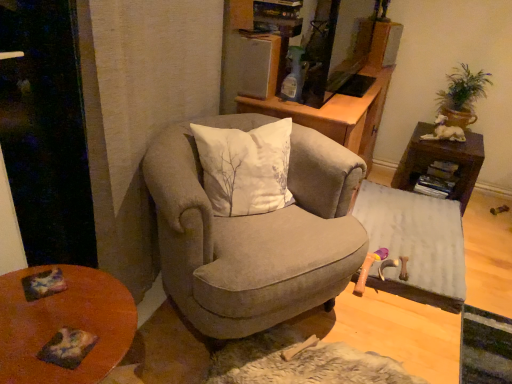
This screenshot has height=384, width=512. Describe the element at coordinates (336, 113) in the screenshot. I see `wooden cabinet at center` at that location.

You are a GUI agent. You are given a task and a screenshot of the screen. Output one action in this format:
    pyautogui.click(x=<x>, y=<y>)
    Task: Click on the green leafy plant at upper right
    
    Given the screenshot: What is the action you would take?
    pyautogui.click(x=462, y=95)

This screenshot has width=512, height=384. I want to click on wooden table at lower left, so click(64, 325).

What do you see at coordinates (255, 236) in the screenshot? This screenshot has width=512, height=384. I see `suede armchair at center` at bounding box center [255, 236].

Consider the image. Measure the distance between point (439, 147) and camera.

Point (439, 147) is 2.50 meters away from camera.

The height and width of the screenshot is (384, 512). What are the coordinates of `wooden cabinet at center` in the screenshot? It's located at (336, 113).

Could you tell me if wooden cabinet at center is facing green leafy plant at upper right?

No, wooden cabinet at center is not oriented towards green leafy plant at upper right.

Are wooden cabinet at center and green leafy plant at upper right located far from each other?

No, wooden cabinet at center is in close proximity to green leafy plant at upper right.

In the image, is wooden cabinet at center positioned in front of or behind green leafy plant at upper right?

wooden cabinet at center is positioned closer to the viewer than green leafy plant at upper right.

How many degrees apart are the facing directions of brown wooden table at right, marked as the second table in a bottom-to-top arrangement, and suede armchair at center?

53.3 degrees.

Is brown wooden table at right, which appears as the first table when viewed from the top, beside suede armchair at center?

No, brown wooden table at right, which appears as the first table when viewed from the top, is not beside suede armchair at center.

Between brown wooden table at right, which appears as the first table when viewed from the top, and suede armchair at center, which one has less height?

Standing shorter between the two is brown wooden table at right, which appears as the first table when viewed from the top.

Which object is closer to the camera taking this photo, brown wooden table at right, which appears as the first table when viewed from the top, or suede armchair at center?

suede armchair at center is more forward.

Is point (454, 107) closer to viewer compared to point (39, 303)?

No, (454, 107) is behind (39, 303).

How different are the orientations of green leafy plant at upper right and wooden table at lower left in degrees?

The facing directions of green leafy plant at upper right and wooden table at lower left are 92.8 degrees apart.

Is green leafy plant at upper right spatially inside wooden table at lower left, or outside of it?

green leafy plant at upper right is spatially situated outside wooden table at lower left.

This screenshot has height=384, width=512. Identify the location of desk below the green leafy plant at upper right (from the image's perspective). (64, 325).

Considering the positions of objects white fabric ottoman at lower right, marked as the 2th table in a top-to-bottom arrangement, and wooden cabinet at center in the image provided, who is more to the right, white fabric ottoman at lower right, marked as the 2th table in a top-to-bottom arrangement, or wooden cabinet at center?

Positioned to the right is white fabric ottoman at lower right, marked as the 2th table in a top-to-bottom arrangement.

Which object is thinner, white fabric ottoman at lower right, marked as the 2th table in a top-to-bottom arrangement, or wooden cabinet at center?

Thinner between the two is white fabric ottoman at lower right, marked as the 2th table in a top-to-bottom arrangement.

In terms of size, does white fabric ottoman at lower right, marked as the 2th table in a top-to-bottom arrangement, appear bigger or smaller than wooden cabinet at center?

Clearly, white fabric ottoman at lower right, marked as the 2th table in a top-to-bottom arrangement, is smaller in size than wooden cabinet at center.

From a real-world perspective, is white fabric ottoman at lower right, marked as the 2th table in a top-to-bottom arrangement, below wooden cabinet at center?

Yes, from a real-world perspective, white fabric ottoman at lower right, marked as the 2th table in a top-to-bottom arrangement, is under wooden cabinet at center.

Is point (330, 135) less distant than point (419, 157)?

Yes, it is.

From the image's perspective, is wooden cabinet at center above or below brown wooden table at right, which appears as the first table when viewed from the top?

From the image's perspective, wooden cabinet at center appears above brown wooden table at right, which appears as the first table when viewed from the top.

How distant is wooden cabinet at center from brown wooden table at right, which appears as the first table when viewed from the top?

The distance of wooden cabinet at center from brown wooden table at right, which appears as the first table when viewed from the top, is 20.72 inches.

From a real-world perspective, does wooden cabinet at center stand above brown wooden table at right, which appears as the first table when viewed from the top?

Yes, from a real-world perspective, wooden cabinet at center is above brown wooden table at right, which appears as the first table when viewed from the top.

In terms of size, does green leafy plant at upper right appear bigger or smaller than wooden cabinet at center?

green leafy plant at upper right is smaller than wooden cabinet at center.

From a real-world perspective, is green leafy plant at upper right above or below wooden cabinet at center?

From a real-world perspective, green leafy plant at upper right is physically above wooden cabinet at center.

Does point (454, 97) come farther from viewer compared to point (315, 108)?

Yes, it is behind point (315, 108).

Is green leafy plant at upper right oriented towards wooden cabinet at center?

No.

Considering the relative sizes of wooden table at lower left and green leafy plant at upper right in the image provided, is wooden table at lower left thinner than green leafy plant at upper right?

In fact, wooden table at lower left might be wider than green leafy plant at upper right.

Considering the positions of objects wooden table at lower left and green leafy plant at upper right in the image provided, who is behind, wooden table at lower left or green leafy plant at upper right?

green leafy plant at upper right is further from the camera.

Is wooden table at lower left aimed at green leafy plant at upper right?

No, wooden table at lower left is not turned towards green leafy plant at upper right.

Is point (83, 286) farther from viewer compared to point (449, 98)?

That is False.

Locate an element on the screen. The height and width of the screenshot is (384, 512). houseplant behind the wooden cabinet at center is located at coordinates (462, 95).

Locate an element on the screen. Image resolution: width=512 pixels, height=384 pixels. the 2nd table counting from the right side of the suede armchair at center is located at coordinates (441, 161).

When comparing their distances from suede armchair at center, does brown wooden table at right, marked as the second table in a bottom-to-top arrangement, or wooden table at lower left seem further?

Based on the image, brown wooden table at right, marked as the second table in a bottom-to-top arrangement, appears to be further to suede armchair at center.

When comparing their distances from white fabric ottoman at lower right, marked as the 2th table in a top-to-bottom arrangement, does brown wooden table at right, which appears as the first table when viewed from the top, or wooden cabinet at center seem closer?

Based on the image, brown wooden table at right, which appears as the first table when viewed from the top, appears to be nearer to white fabric ottoman at lower right, marked as the 2th table in a top-to-bottom arrangement.

Based on their spatial positions, is green leafy plant at upper right or wooden cabinet at center further from wooden table at lower left?

The object further to wooden table at lower left is green leafy plant at upper right.

From the picture: Based on their spatial positions, is wooden cabinet at center or brown wooden table at right, which appears as the first table when viewed from the top, closer to white fabric ottoman at lower right, marked as the 2th table in a top-to-bottom arrangement?

brown wooden table at right, which appears as the first table when viewed from the top, is positioned closer to the anchor white fabric ottoman at lower right, marked as the 2th table in a top-to-bottom arrangement.

When comparing their distances from brown wooden table at right, marked as the second table in a bottom-to-top arrangement, does white fabric ottoman at lower right, marked as the 2th table in a top-to-bottom arrangement, or wooden table at lower left seem closer?

Based on the image, white fabric ottoman at lower right, marked as the 2th table in a top-to-bottom arrangement, appears to be nearer to brown wooden table at right, marked as the second table in a bottom-to-top arrangement.

Considering their positions, is wooden cabinet at center positioned further to white fabric ottoman at lower right, acting as the first table starting from the bottom, than wooden table at lower left?

wooden table at lower left lies further to white fabric ottoman at lower right, acting as the first table starting from the bottom, than the other object.

From the image, which object appears to be nearer to wooden cabinet at center, green leafy plant at upper right or white fabric ottoman at lower right, marked as the 2th table in a top-to-bottom arrangement?

The object closer to wooden cabinet at center is white fabric ottoman at lower right, marked as the 2th table in a top-to-bottom arrangement.

Which object lies nearer to the anchor point white fabric ottoman at lower right, marked as the 2th table in a top-to-bottom arrangement, suede armchair at center or green leafy plant at upper right?

green leafy plant at upper right is closer to white fabric ottoman at lower right, marked as the 2th table in a top-to-bottom arrangement.

Where is `table between suede armchair at center and green leafy plant at upper right from front to back`? The height and width of the screenshot is (384, 512). table between suede armchair at center and green leafy plant at upper right from front to back is located at coordinates (415, 244).

This screenshot has width=512, height=384. Identify the location of chair between wooden table at lower left and green leafy plant at upper right. (255, 236).

Where is `cabinetry situated between wooden table at lower left and white fabric ottoman at lower right, marked as the 2th table in a top-to-bottom arrangement, from left to right`? cabinetry situated between wooden table at lower left and white fabric ottoman at lower right, marked as the 2th table in a top-to-bottom arrangement, from left to right is located at coordinates (336, 113).

Find the location of a particular element. The image size is (512, 384). chair between wooden table at lower left and white fabric ottoman at lower right, acting as the first table starting from the bottom, in the horizontal direction is located at coordinates (255, 236).